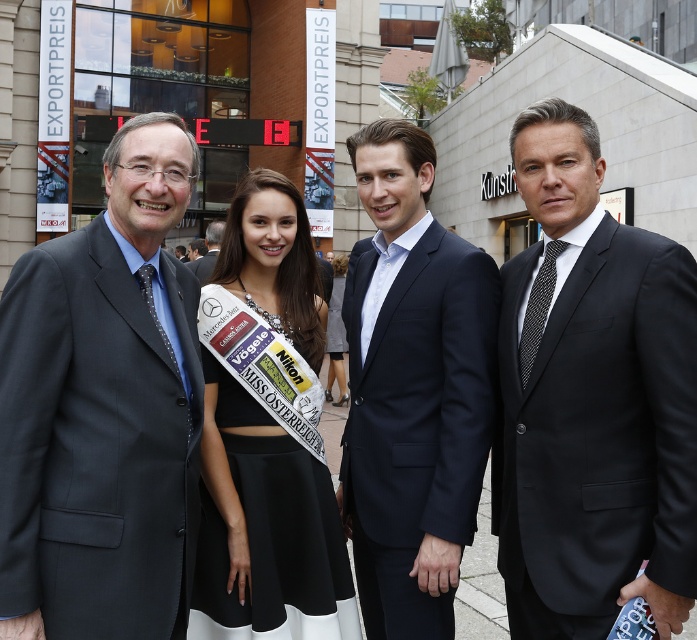
Question: Based on their relative distances, which object is farther from the white satin sash at center?

Choices:
 (A) black satin suit at right
 (B) dark blue suit at left
 (C) navy wool suit at center

Answer: (A)

Question: Can you confirm if navy wool suit at center is positioned above matte black suit at center?

Choices:
 (A) yes
 (B) no

Answer: (B)

Question: Can you confirm if white satin sash at center is positioned below matte black suit at center?

Choices:
 (A) no
 (B) yes

Answer: (B)

Question: Which point is farther to the camera?

Choices:
 (A) (696, 326)
 (B) (107, 388)
 (C) (187, 266)
 (D) (238, 442)

Answer: (C)

Question: Observing the image, what is the correct spatial positioning of black satin suit at right in reference to dark blue suit at left?

Choices:
 (A) below
 (B) above

Answer: (A)

Question: Which object appears closest to the camera in this image?

Choices:
 (A) navy wool suit at center
 (B) black satin suit at right
 (C) white satin sash at center
 (D) matte black suit at center

Answer: (B)